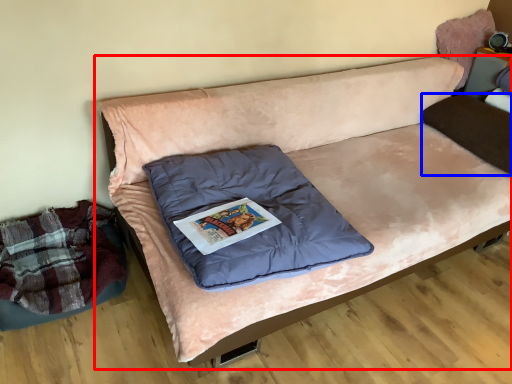
Question: Which object is further to the camera taking this photo, studio couch (highlighted by a red box) or pillow (highlighted by a blue box)?

Choices:
 (A) studio couch
 (B) pillow

Answer: (B)